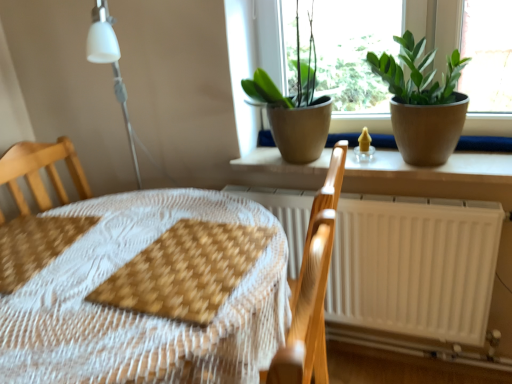
Locate an element on the screen. The image size is (512, 384). vacant space underneath green matte plant at upper right, the 2th houseplant viewed from the left (from a real-world perspective) is located at coordinates (409, 162).